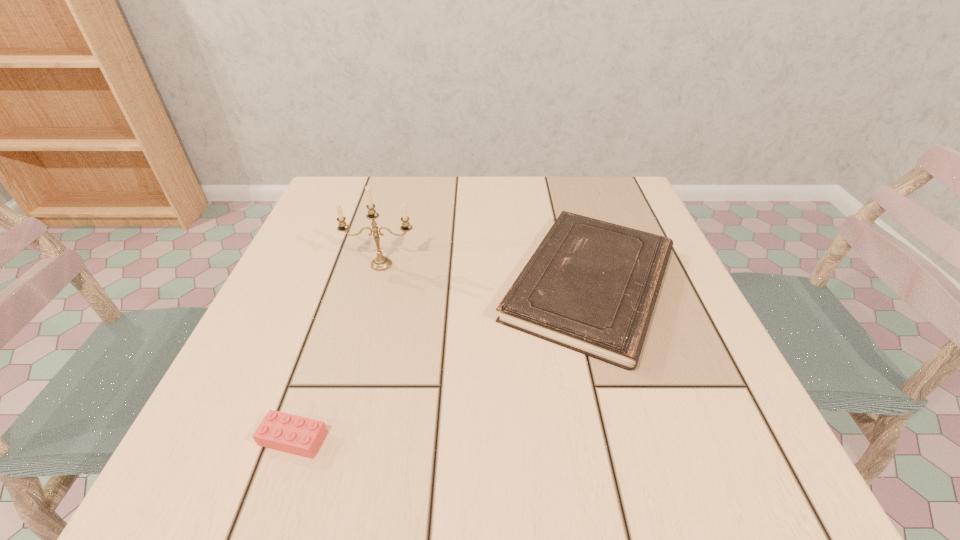
You are a GUI agent. You are given a task and a screenshot of the screen. Output one action in this format:
    pyautogui.click(x=<x>, y=<y>)
    Task: Click on the vacant space that is in between the tallest object and the nearest object
    This screenshot has width=960, height=540.
    Given the screenshot: What is the action you would take?
    pyautogui.click(x=337, y=352)

Image resolution: width=960 pixels, height=540 pixels. In order to click on object that is the second closest to the tallest object in this screenshot , I will do `click(293, 434)`.

Where is `object that is the second closest one to the paperback book`? object that is the second closest one to the paperback book is located at coordinates (293, 434).